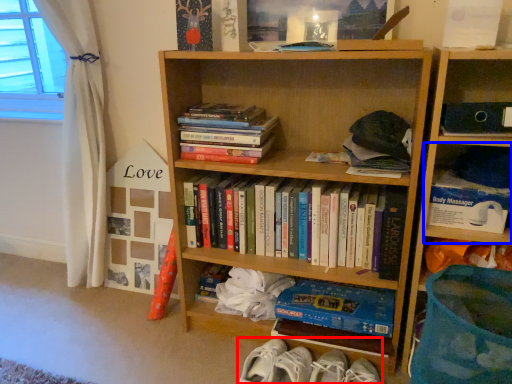
Question: Among these objects, which one is nearest to the camera, footwear (highlighted by a red box) or shelf (highlighted by a blue box)?

Choices:
 (A) footwear
 (B) shelf

Answer: (B)